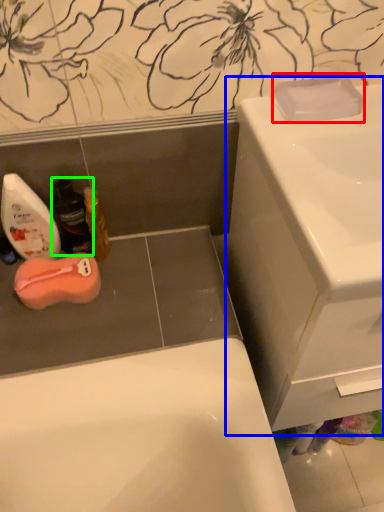
Question: Which object is positioned closest to soap (highlighted by a red box)? Select from sink (highlighted by a blue box) and mouthwash (highlighted by a green box).

Choices:
 (A) sink
 (B) mouthwash

Answer: (A)